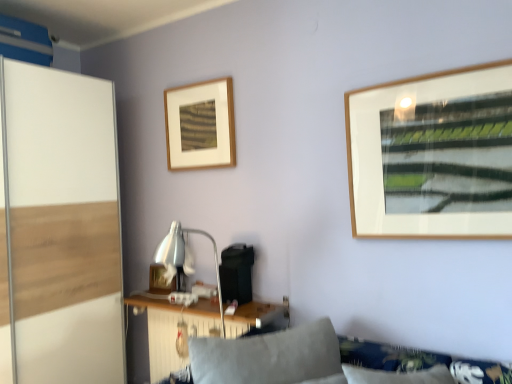
Question: Can you confirm if white glossy screen door at left is smaller than soft gray cushion at lower center?

Choices:
 (A) yes
 (B) no

Answer: (B)

Question: Is white glossy screen door at left bigger than soft gray cushion at lower center?

Choices:
 (A) yes
 (B) no

Answer: (A)

Question: Does white glossy screen door at left have a lesser height compared to soft gray cushion at lower center?

Choices:
 (A) no
 (B) yes

Answer: (A)

Question: Is white glossy screen door at left at the right side of soft gray cushion at lower center?

Choices:
 (A) yes
 (B) no

Answer: (B)

Question: From the image's perspective, is white glossy screen door at left beneath soft gray cushion at lower center?

Choices:
 (A) no
 (B) yes

Answer: (A)

Question: Looking at their shapes, would you say wooden picture frame at upper center, the 2th picture frame positioned from the bottom, is wider or thinner than soft gray cushion at lower center?

Choices:
 (A) thin
 (B) wide

Answer: (A)

Question: From a real-world perspective, is wooden picture frame at upper center, arranged as the 2th picture frame when viewed from the back, physically located above or below soft gray cushion at lower center?

Choices:
 (A) above
 (B) below

Answer: (A)

Question: Considering the positions of point (181, 130) and point (203, 352), is point (181, 130) closer or farther from the camera than point (203, 352)?

Choices:
 (A) closer
 (B) farther

Answer: (B)

Question: In terms of height, does wooden picture frame at upper center, positioned as the 1th picture frame in front-to-back order, look taller or shorter compared to soft gray cushion at lower center?

Choices:
 (A) tall
 (B) short

Answer: (A)

Question: Is wooden picture frame at upper center, which is the first picture frame from right to left, in front of or behind white glossy screen door at left in the image?

Choices:
 (A) behind
 (B) front

Answer: (A)

Question: From the image's perspective, is wooden picture frame at upper center, the 1th picture frame when ordered from top to bottom, above or below white glossy screen door at left?

Choices:
 (A) above
 (B) below

Answer: (A)

Question: Considering the positions of point (196, 137) and point (3, 167), is point (196, 137) closer or farther from the camera than point (3, 167)?

Choices:
 (A) farther
 (B) closer

Answer: (A)

Question: From a real-world perspective, relative to white glossy screen door at left, is wooden picture frame at upper center, arranged as the 2th picture frame when viewed from the back, vertically above or below?

Choices:
 (A) below
 (B) above

Answer: (B)

Question: Looking at the image, does white glossy screen door at left seem bigger or smaller compared to wooden table at lower center?

Choices:
 (A) small
 (B) big

Answer: (B)

Question: Considering the positions of white glossy screen door at left and wooden table at lower center in the image, is white glossy screen door at left wider or thinner than wooden table at lower center?

Choices:
 (A) thin
 (B) wide

Answer: (B)